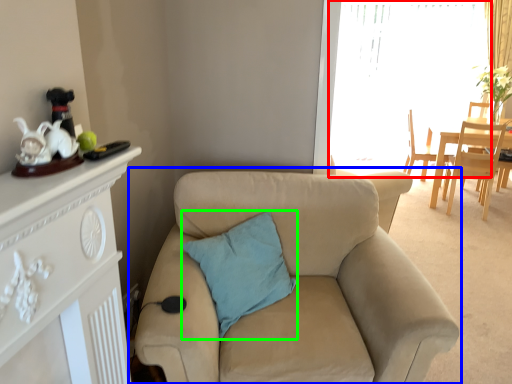
Question: Which object is positioned closest to window screen (highlighted by a red box)? Select from studio couch (highlighted by a blue box) and pillow (highlighted by a green box).

Choices:
 (A) studio couch
 (B) pillow

Answer: (A)